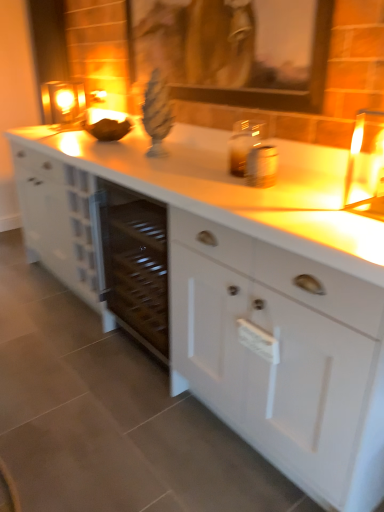
Question: From a real-world perspective, is white matte cabinet at center above or below wooden picture frame at upper center?

Choices:
 (A) below
 (B) above

Answer: (A)

Question: Considering the positions of white matte cabinet at center and wooden picture frame at upper center in the image, is white matte cabinet at center taller or shorter than wooden picture frame at upper center?

Choices:
 (A) short
 (B) tall

Answer: (B)

Question: Which object is positioned farthest from the matte glass candle at upper left?

Choices:
 (A) wooden picture frame at upper center
 (B) white matte cabinet at center

Answer: (B)

Question: Considering the real-world distances, which object is farthest from the white matte cabinet at center?

Choices:
 (A) wooden picture frame at upper center
 (B) matte glass candle at upper left

Answer: (B)